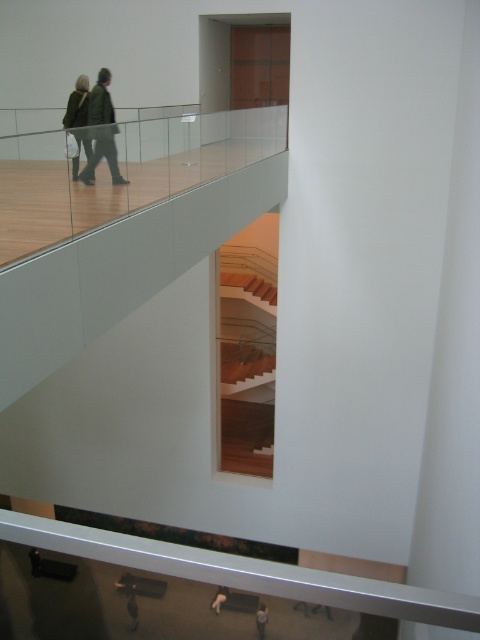
Is wooden stairs at center above green wool coat at upper left?

No, wooden stairs at center is not above green wool coat at upper left.

Is wooden stairs at center taller than green wool coat at upper left?

Correct, wooden stairs at center is much taller as green wool coat at upper left.

You are a GUI agent. You are given a task and a screenshot of the screen. Output one action in this format:
    pyautogui.click(x=<x>, y=<y>)
    Task: Click on the wooden stairs at center
    The width and height of the screenshot is (480, 640).
    Given the screenshot: What is the action you would take?
    pyautogui.click(x=247, y=372)

Find the location of `wooden stairs at center`. wooden stairs at center is located at coordinates (247, 372).

Can you confirm if wooden stairs at center is smaller than dark gray fabric pants at lower center?

Correct, wooden stairs at center occupies less space than dark gray fabric pants at lower center.

Does point (244, 276) lie behind point (219, 605)?

Yes, it is behind point (219, 605).

At what (x,y) coordinates should I click in order to perform the action: click on wooden stairs at center. Please return your answer as a coordinate pair (x, y). Looking at the image, I should click on (247, 372).

Is point (252, 378) positioned after point (84, 84)?

Yes, point (252, 378) is farther from viewer.

Who is higher up, wooden stairs at center or green fabric jacket at upper left?

Positioned higher is green fabric jacket at upper left.

Who is more distant from viewer, (259, 346) or (75, 113)?

The point (259, 346) is more distant.

Find the location of a particular element. This screenshot has width=480, height=640. wooden stairs at center is located at coordinates (247, 372).